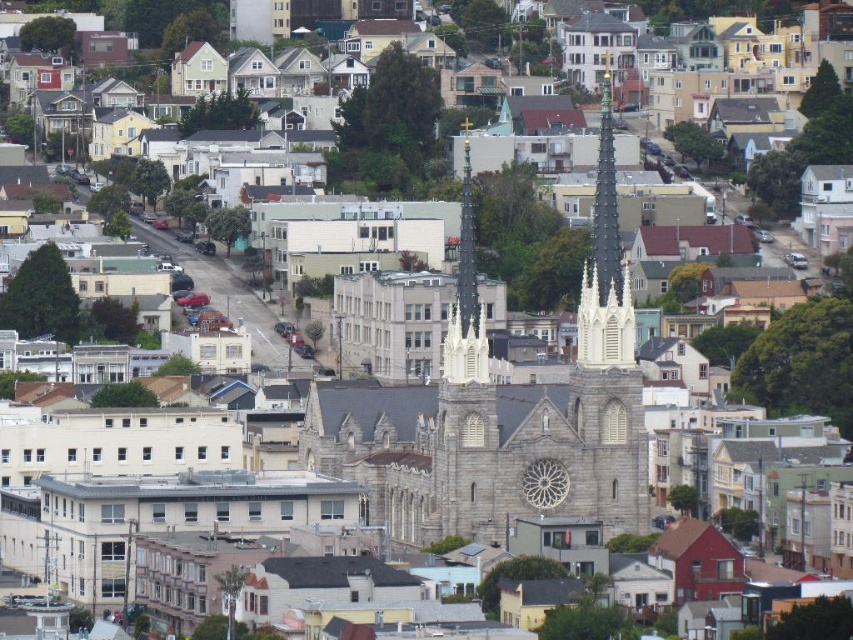
Which is below, gray stone church spire at center or white stone spire at center?

gray stone church spire at center

Which of these two, gray stone church spire at center or white stone spire at center, stands taller?

gray stone church spire at center is taller.

Is point (462, 528) positioned in front of point (608, 90)?

Yes.

The width and height of the screenshot is (853, 640). What are the coordinates of `gray stone church spire at center` in the screenshot? It's located at (502, 412).